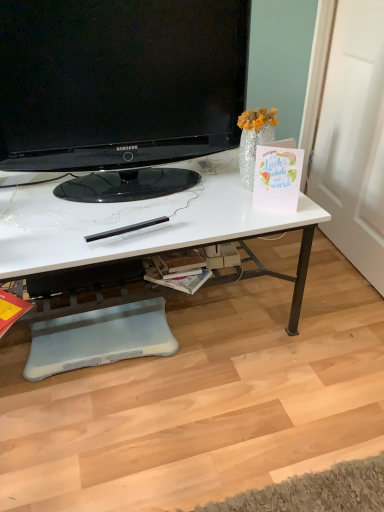
Question: Does white paper magazine at center, acting as the 1th magazine starting from the right, have a lesser height compared to black glossy television at upper center?

Choices:
 (A) no
 (B) yes

Answer: (B)

Question: From the image's perspective, would you say white paper magazine at center, acting as the 1th magazine starting from the right, is positioned over black glossy television at upper center?

Choices:
 (A) no
 (B) yes

Answer: (A)

Question: From a real-world perspective, is white paper magazine at center, acting as the 1th magazine starting from the right, positioned under black glossy television at upper center based on gravity?

Choices:
 (A) yes
 (B) no

Answer: (A)

Question: From a real-world perspective, does white paper magazine at center, acting as the 1th magazine starting from the right, stand above black glossy television at upper center?

Choices:
 (A) no
 (B) yes

Answer: (A)

Question: Is white paper magazine at center, the 2th magazine from the left, surrounding black glossy television at upper center?

Choices:
 (A) no
 (B) yes

Answer: (A)

Question: Is white paper magazine at center, the 2th magazine from the left, positioned in front of black glossy television at upper center?

Choices:
 (A) yes
 (B) no

Answer: (B)

Question: Is white paper magazine at center, the 2th magazine from the left, positioned with its back to matte yellow magazine at lower left, which is the 1th magazine from left to right?

Choices:
 (A) no
 (B) yes

Answer: (A)

Question: From the image's perspective, is white paper magazine at center, the 2th magazine from the left, under matte yellow magazine at lower left, which is the 1th magazine from left to right?

Choices:
 (A) no
 (B) yes

Answer: (A)

Question: Does white paper magazine at center, the 2th magazine from the left, contain matte yellow magazine at lower left, which is the 1th magazine from left to right?

Choices:
 (A) no
 (B) yes

Answer: (A)

Question: Is white paper magazine at center, the 2th magazine from the left, at the left side of matte yellow magazine at lower left, which is the 1th magazine from left to right?

Choices:
 (A) no
 (B) yes

Answer: (A)

Question: From a real-world perspective, is white paper magazine at center, the 2th magazine from the left, located higher than matte yellow magazine at lower left, which is the 1th magazine from left to right?

Choices:
 (A) no
 (B) yes

Answer: (B)

Question: Can you confirm if white paper magazine at center, the 2th magazine from the left, is smaller than matte yellow magazine at lower left, which is the 1th magazine from left to right?

Choices:
 (A) no
 (B) yes

Answer: (B)

Question: Does matte yellow magazine at lower left, placed as the 2th magazine when sorted from right to left, have a greater height compared to white glossy desk at center?

Choices:
 (A) no
 (B) yes

Answer: (A)